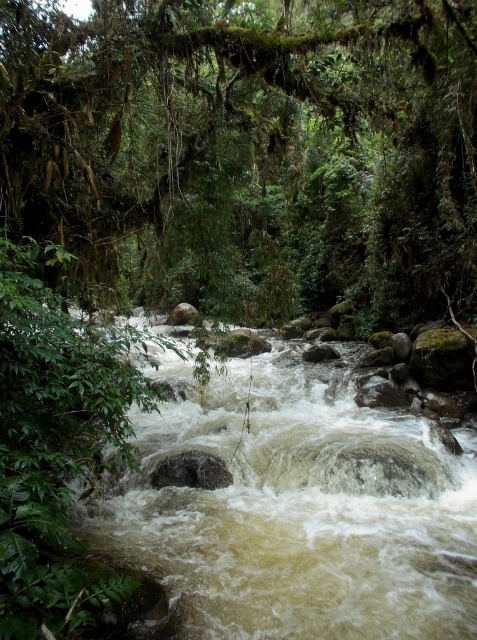
Between green mossy tree at center and white frothy water at center, which one is positioned lower?

Positioned lower is white frothy water at center.

Is green mossy tree at center to the right of white frothy water at center from the viewer's perspective?

Incorrect, green mossy tree at center is not on the right side of white frothy water at center.

At what (x,y) coordinates should I click in order to perform the action: click on green mossy tree at center. Please return your answer as a coordinate pair (x, y). Looking at the image, I should click on pyautogui.click(x=248, y=148).

You are a GUI agent. You are given a task and a screenshot of the screen. Output one action in this format:
    pyautogui.click(x=<x>, y=<y>)
    Task: Click on the green mossy tree at center
    This screenshot has width=477, height=640.
    Given the screenshot: What is the action you would take?
    pyautogui.click(x=248, y=148)